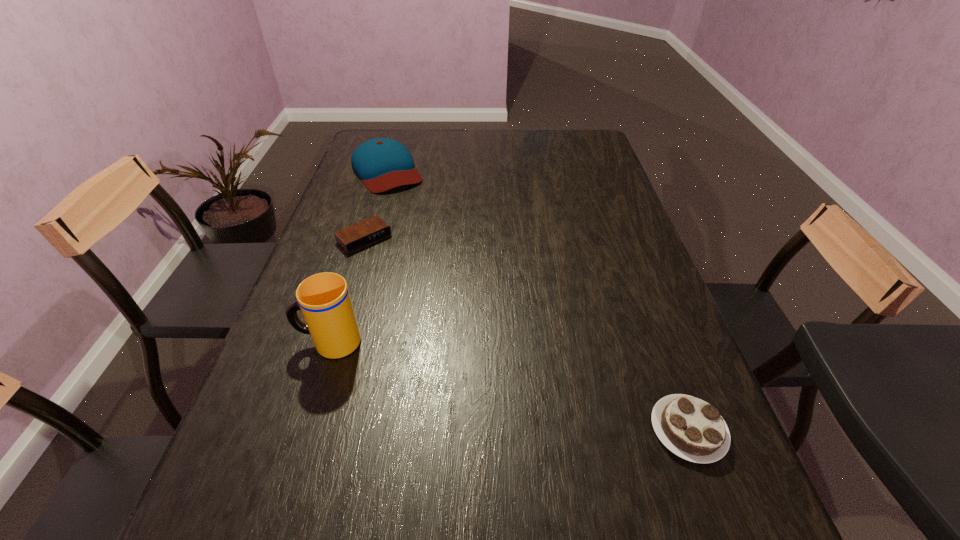
This screenshot has height=540, width=960. I want to click on vacant point located between the rightmost object and the cup, so click(509, 386).

What are the coordinates of `vacant area that lies between the third tallest object and the tallest object` in the screenshot? It's located at (509, 386).

The width and height of the screenshot is (960, 540). I want to click on empty location between the alarm clock and the baseball cap, so click(375, 205).

Identify the location of free spot between the nearest object and the baseball cap. The height and width of the screenshot is (540, 960). (538, 300).

This screenshot has height=540, width=960. In order to click on free space between the shortest object and the second tallest object in this screenshot , I will do `click(375, 205)`.

Identify the location of free space between the chocolate cake and the farthest object. The height and width of the screenshot is (540, 960). (538, 300).

Locate an element on the screen. This screenshot has width=960, height=540. object that is the second closest to the rightmost object is located at coordinates (359, 235).

This screenshot has height=540, width=960. What are the coordinates of `object that ranks as the second closest to the tallest object` in the screenshot? It's located at (382, 164).

Where is `free spot that satisfies the following two spatial constraints: 1. on the front side of the second shortest object; 2. on the right side of the alarm clock`? The image size is (960, 540). free spot that satisfies the following two spatial constraints: 1. on the front side of the second shortest object; 2. on the right side of the alarm clock is located at coordinates (305, 430).